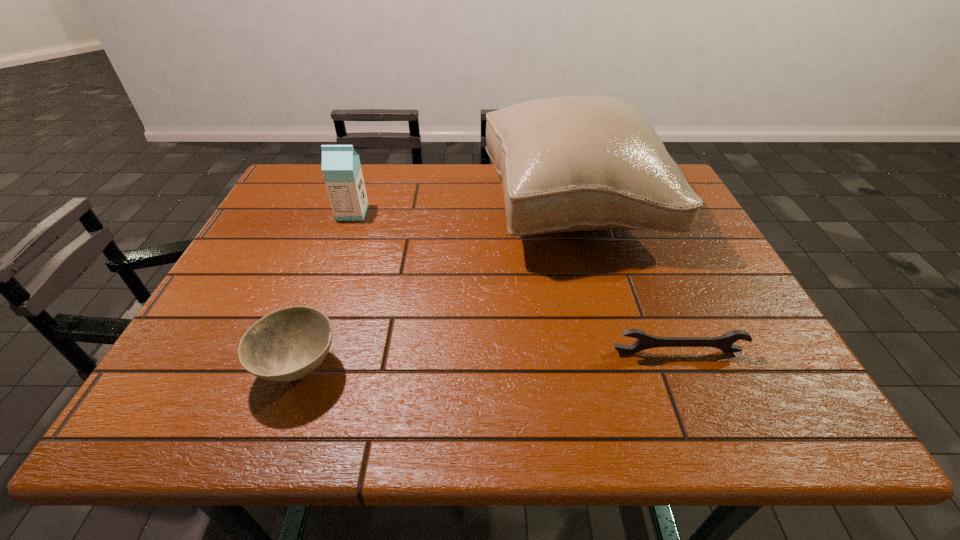
Find the location of `object that stands as the closest to the shortest object`. object that stands as the closest to the shortest object is located at coordinates (572, 163).

You are a GUI agent. You are given a task and a screenshot of the screen. Output one action in this format:
    pyautogui.click(x=<x>, y=<y>)
    Task: Click on the second closest object to the bowl
    This screenshot has width=960, height=540.
    Given the screenshot: What is the action you would take?
    pyautogui.click(x=341, y=168)